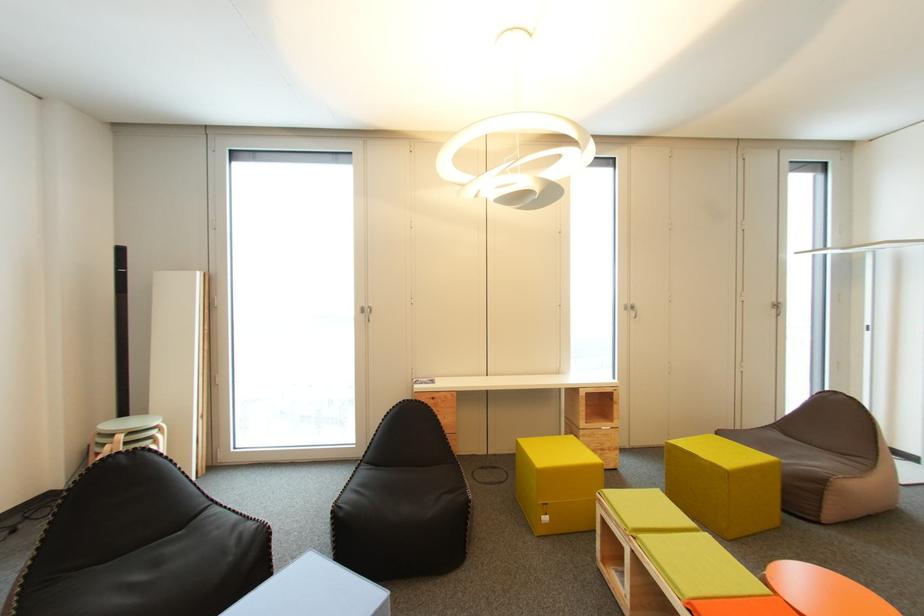
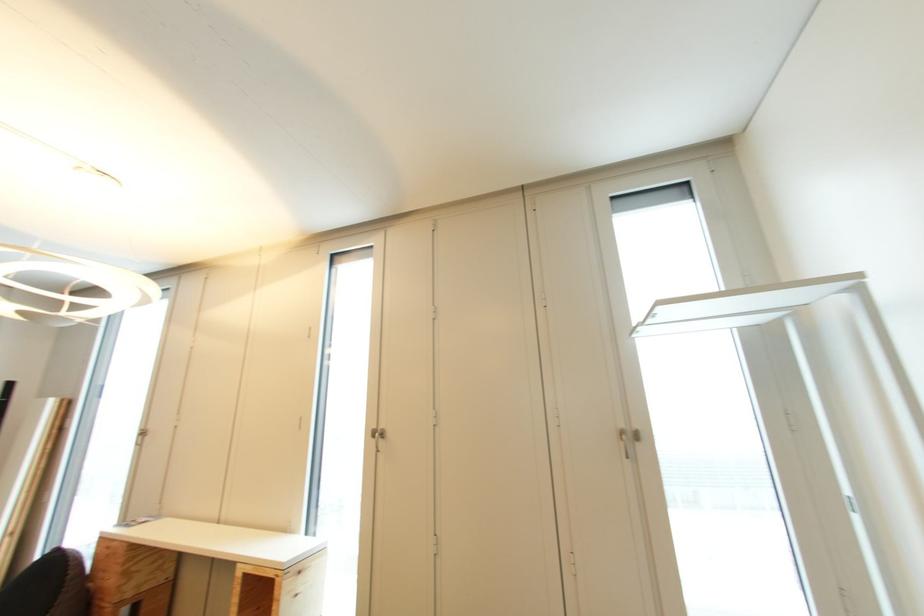
What movement of the cameraman would produce the second image?

The cameraman walked toward right, forward.